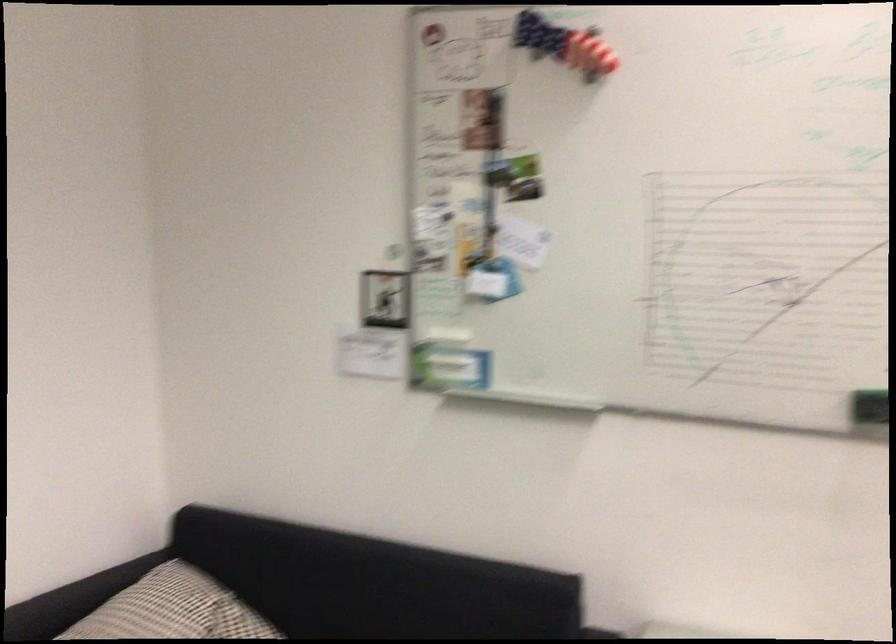
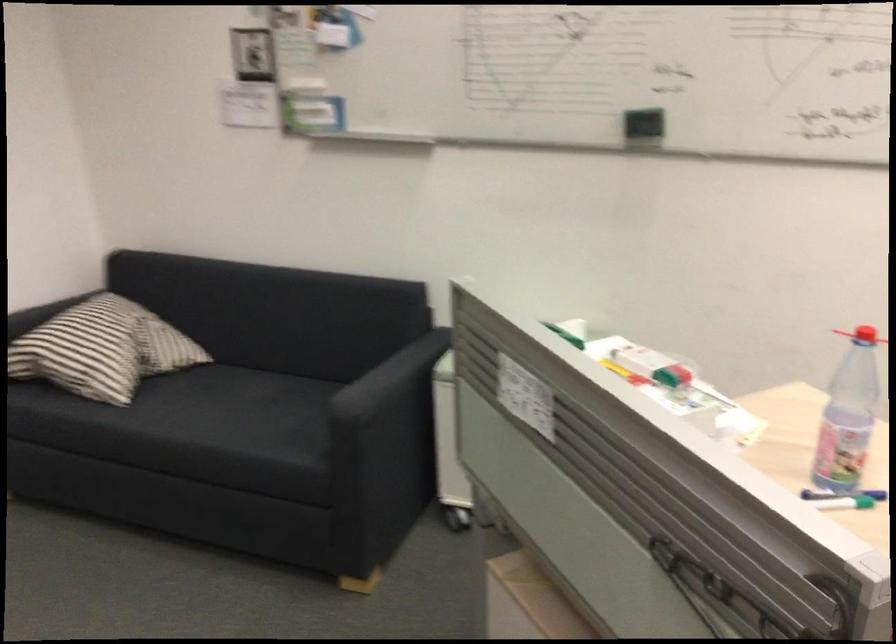
Question: The images are taken continuously from a first-person perspective. In which direction is your viewpoint rotating?

Choices:
 (A) Left
 (B) Right
 (C) Up
 (D) Down

Answer: (D)